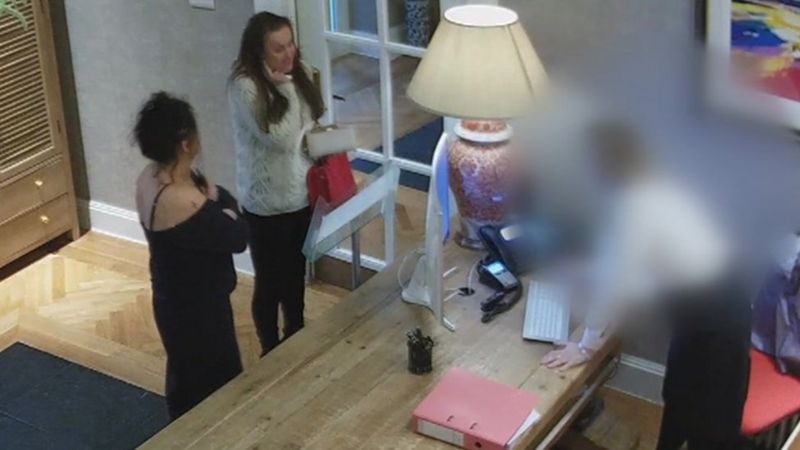
Where is `lamp shade`? The height and width of the screenshot is (450, 800). lamp shade is located at coordinates (466, 73).